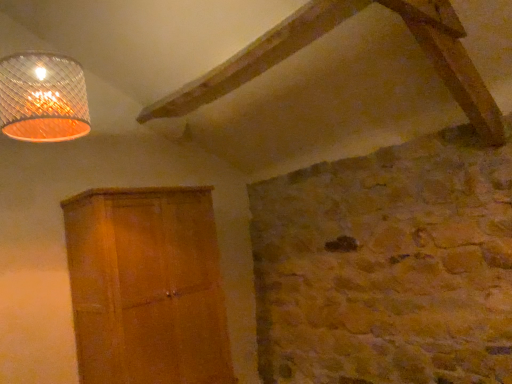
This screenshot has width=512, height=384. What do you see at coordinates (146, 286) in the screenshot?
I see `wooden at left` at bounding box center [146, 286].

This screenshot has height=384, width=512. In order to click on wooden at left in this screenshot , I will do `click(146, 286)`.

Identify the location of wooden at left. This screenshot has height=384, width=512. (146, 286).